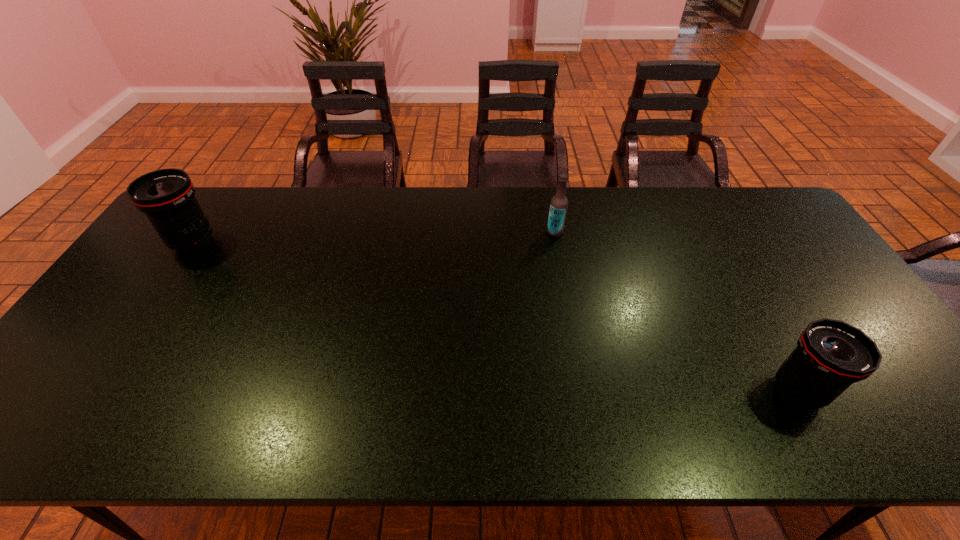
Locate an element on the screen. the farther telephoto lens is located at coordinates (167, 197).

Where is `the taller telephoto lens`? The image size is (960, 540). the taller telephoto lens is located at coordinates (167, 197).

I want to click on the second object from left to right, so click(x=558, y=207).

At what (x,y) coordinates should I click in order to perform the action: click on the rightmost object. Please return your answer as a coordinate pair (x, y). This screenshot has width=960, height=540. Looking at the image, I should click on (831, 355).

You are a GUI agent. You are given a task and a screenshot of the screen. Output one action in this format:
    pyautogui.click(x=<x>, y=<y>)
    Task: Click on the nearest object
    
    Given the screenshot: What is the action you would take?
    pyautogui.click(x=831, y=355)

In order to click on vacant space located on the right of the leftmost object in this screenshot , I will do `click(253, 242)`.

Locate an element on the screen. blank space located on the side of the beer bottle with the label is located at coordinates (425, 232).

Locate an element on the screen. free spot located on the side of the beer bottle with the label is located at coordinates (463, 232).

Image resolution: width=960 pixels, height=540 pixels. I want to click on vacant space located 0.260m on the side of the beer bottle with the label, so click(x=466, y=232).

Locate an element on the screen. free space located on the left of the nearest object is located at coordinates (613, 391).